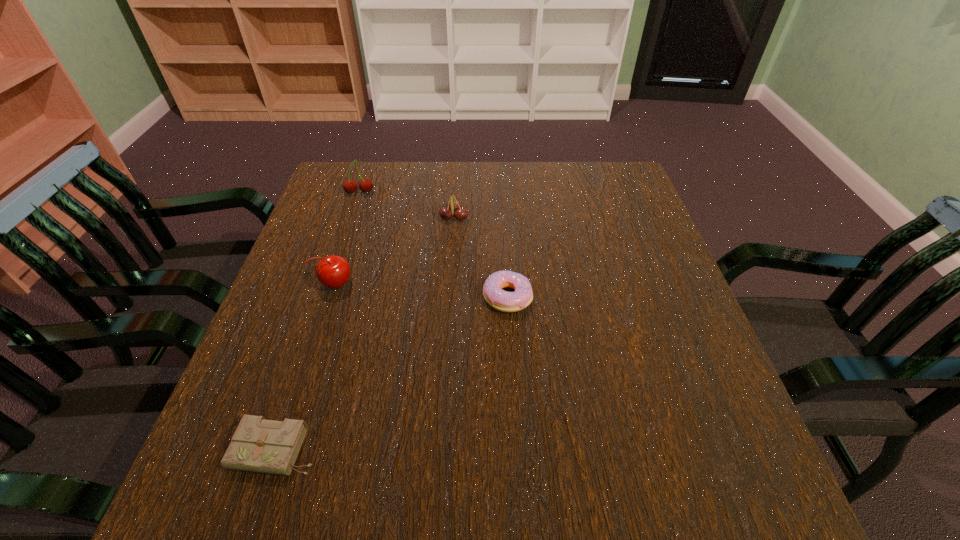
Image resolution: width=960 pixels, height=540 pixels. Find the location of `vacant space located 0.160m on the right of the fourth shortest object`. vacant space located 0.160m on the right of the fourth shortest object is located at coordinates (423, 284).

Where is `vacant region located on the leaves of the shortest cherry`? This screenshot has height=540, width=960. vacant region located on the leaves of the shortest cherry is located at coordinates (498, 218).

Find the location of `free space located 0.360m on the left of the doughnut`. free space located 0.360m on the left of the doughnut is located at coordinates (322, 297).

Where is `vacant space located on the back of the shortest object`? Image resolution: width=960 pixels, height=540 pixels. vacant space located on the back of the shortest object is located at coordinates (331, 284).

Identify the location of object that is at the near edge. This screenshot has width=960, height=540. (258, 445).

Locate an element on the screen. The height and width of the screenshot is (540, 960). diary that is at the left edge is located at coordinates (258, 445).

This screenshot has width=960, height=540. Find the location of `object that is at the far left corner`. object that is at the far left corner is located at coordinates (365, 185).

In order to click on object that is at the near left corner in this screenshot , I will do `click(258, 445)`.

Locate an element on the screen. vacant space at the far edge is located at coordinates (518, 198).

Locate an element on the screen. The height and width of the screenshot is (540, 960). free spot at the near edge of the desktop is located at coordinates (599, 492).